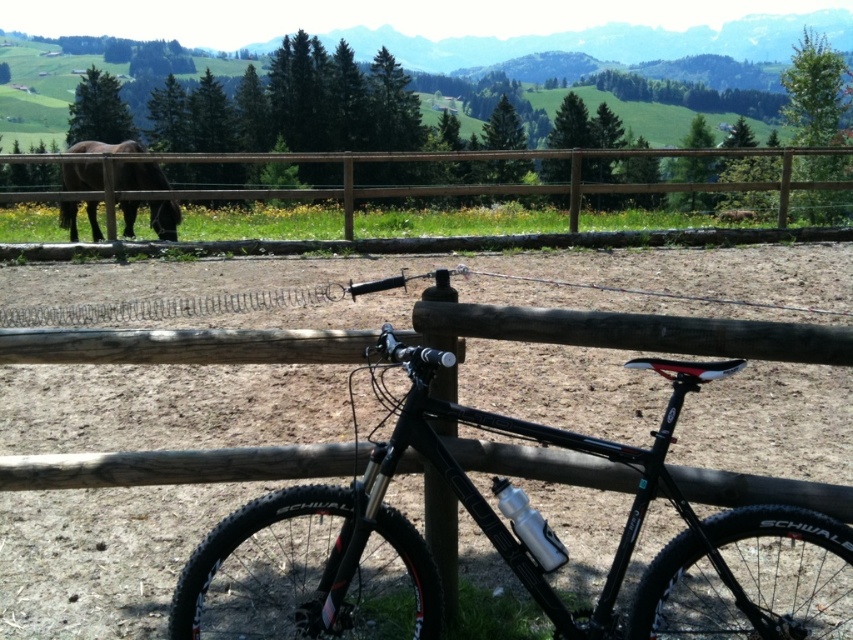
Question: Which point is closer to the camera?

Choices:
 (A) (636, 634)
 (B) (141, 150)

Answer: (A)

Question: Which point is farther to the camera?

Choices:
 (A) brown wooden fence at upper center
 (B) black matte mountain bike at center

Answer: (A)

Question: Estimate the real-world distances between objects in this image. Which object is closer to the brown wooden fence at upper center?

Choices:
 (A) black matte mountain bike at center
 (B) brown matte horse at left

Answer: (B)

Question: Does black matte mountain bike at center have a lesser width compared to brown matte horse at left?

Choices:
 (A) yes
 (B) no

Answer: (B)

Question: Can you confirm if brown wooden fence at upper center is positioned above brown matte horse at left?

Choices:
 (A) no
 (B) yes

Answer: (B)

Question: Is the position of black matte mountain bike at center more distant than that of brown matte horse at left?

Choices:
 (A) no
 (B) yes

Answer: (A)